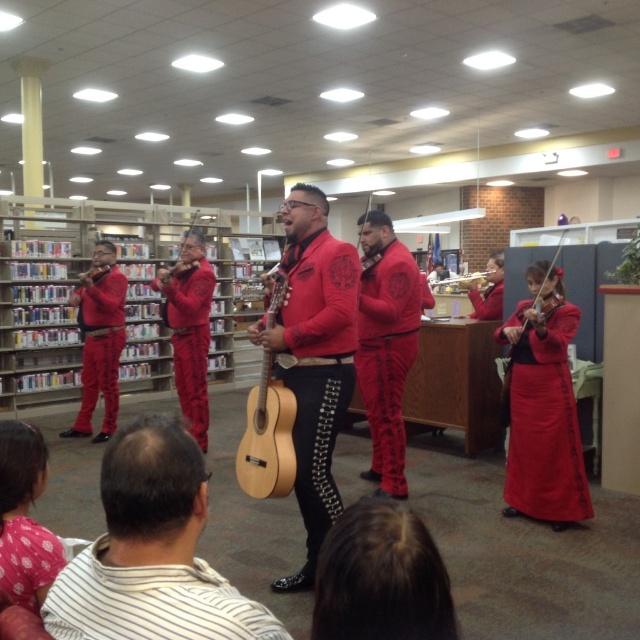
You are standing at point (93, 260) and want to move to point (550, 461). Is there a clear path between these two points?

Point (550, 461) is in front of point (93, 260), so there is a clear path between them.

In the library scene, there is a point marked at coordinates [189,328]. What object in the image corresponds to this point?

The point at coordinates [189,328] corresponds to the matte red mariachi outfit at center.

You are standing in the library where the mariachi band is performing. You notice two points marked in the image. Which point, point 1 at coordinates (186, 340) or point 2 at coordinates (90, 278), is closer to you?

Point 1 at coordinates (186, 340) is closer to the viewer than point 2 at coordinates (90, 278).